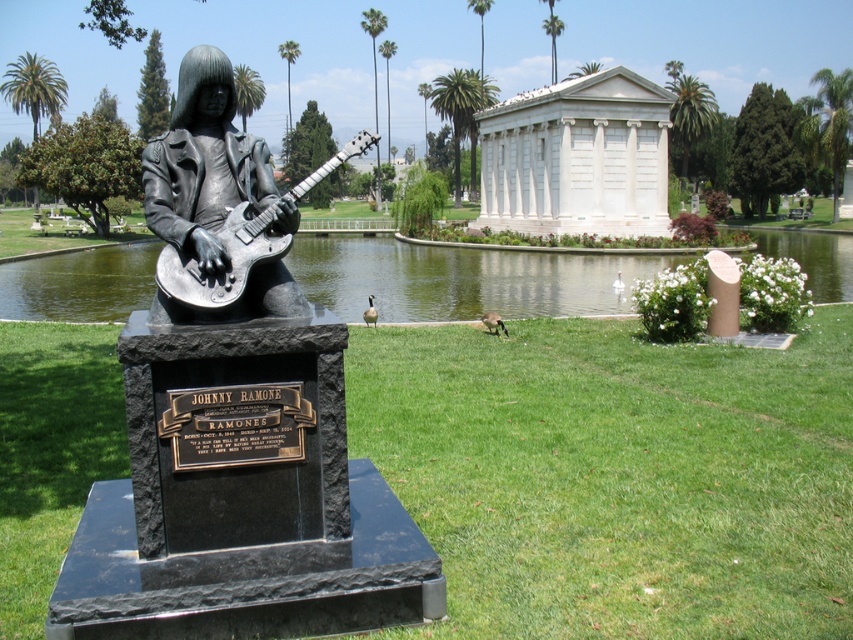
Question: Which object appears farthest from the camera in this image?

Choices:
 (A) polished silver guitar at center
 (B) green water at center
 (C) shiny metallic guitar at center
 (D) polished bronze statue at left

Answer: (B)

Question: Among these objects, which one is farthest from the camera?

Choices:
 (A) polished bronze statue at left
 (B) green water at center

Answer: (B)

Question: Among these points, which one is nearest to the camera?

Choices:
 (A) (578, 289)
 (B) (161, 305)

Answer: (B)

Question: Can you confirm if polished silver guitar at center is positioned to the right of shiny metallic guitar at center?

Choices:
 (A) no
 (B) yes

Answer: (A)

Question: Is polished bronze statue at left thinner than green water at center?

Choices:
 (A) no
 (B) yes

Answer: (B)

Question: Can you confirm if polished bronze statue at left is positioned to the left of green water at center?

Choices:
 (A) no
 (B) yes

Answer: (B)